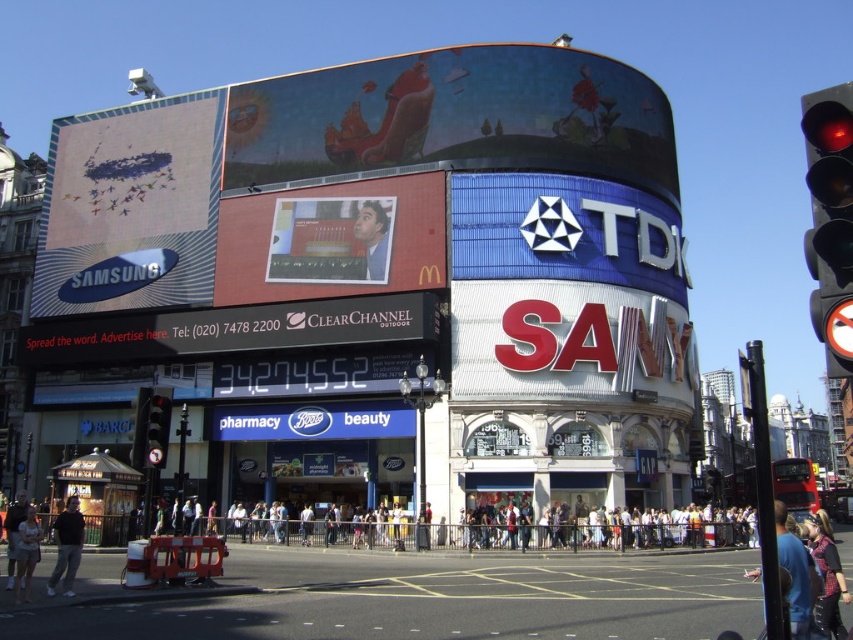
Question: Which point is closer to the camera?

Choices:
 (A) (28, 550)
 (B) (335, 168)

Answer: (A)

Question: Does white metallic sign at upper center appear on the right side of dark gray pants at lower left?

Choices:
 (A) yes
 (B) no

Answer: (A)

Question: Does red glass traffic light at left appear on the left side of light brown leather jacket at lower left?

Choices:
 (A) yes
 (B) no

Answer: (B)

Question: Which of the following is the farthest from the observer?

Choices:
 (A) (790, 573)
 (B) (224, 408)

Answer: (B)

Question: Is matte blue sky at upper center thinner than matte red billboard at center?

Choices:
 (A) no
 (B) yes

Answer: (A)

Question: Which is farther from the black glass traffic light at right?

Choices:
 (A) white cotton shirt at lower left
 (B) blue denim jeans at lower right
 (C) light brown leather jacket at lower left

Answer: (A)